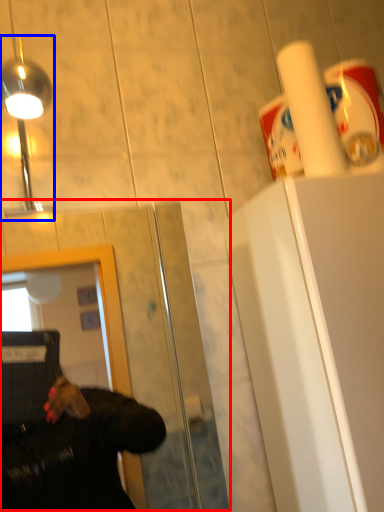
Question: Among these objects, which one is farthest to the camera, glass door (highlighted by a red box) or light fixture (highlighted by a blue box)?

Choices:
 (A) glass door
 (B) light fixture

Answer: (B)